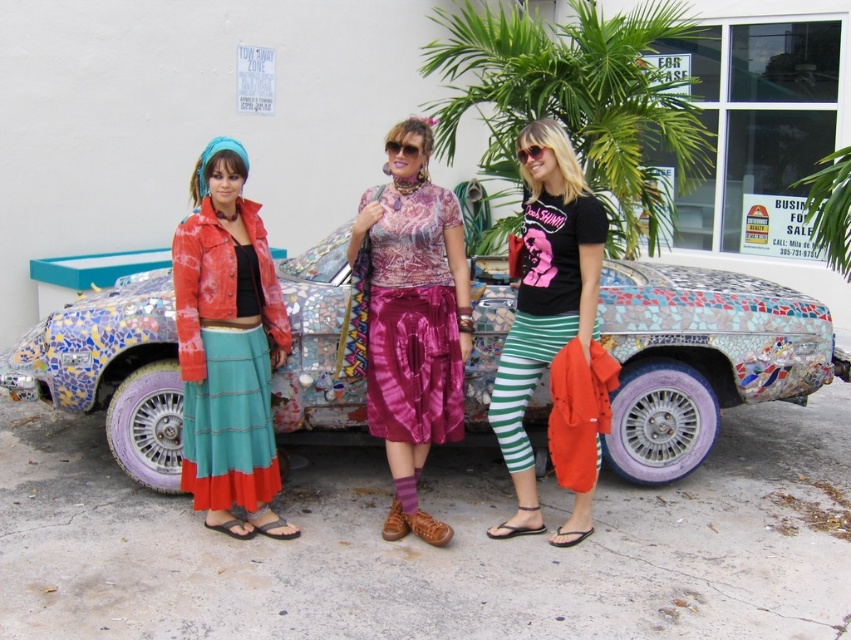
Between multicolored mosaic car at center and green striped leggings at center, which one is positioned higher?

green striped leggings at center is above.

Who is lower down, multicolored mosaic car at center or green striped leggings at center?

Positioned lower is multicolored mosaic car at center.

Is point (681, 344) farther from camera compared to point (530, 230)?

Yes, point (681, 344) is behind point (530, 230).

Find the location of a particular element. multicolored mosaic car at center is located at coordinates (701, 356).

Can you confirm if shiny silk blouse at center is positioned above green striped leggings at center?

Yes, shiny silk blouse at center is above green striped leggings at center.

Which is behind, point (421, 234) or point (597, 262)?

Positioned behind is point (421, 234).

The image size is (851, 640). Find the location of `shiny silk blouse at center`. shiny silk blouse at center is located at coordinates (413, 321).

Find the location of a particular element. This screenshot has width=851, height=640. shiny silk blouse at center is located at coordinates (413, 321).

Is matte red jacket at center to the right of green striped leggings at center from the viewer's perspective?

No, matte red jacket at center is not to the right of green striped leggings at center.

Who is more forward, (210,224) or (598,243)?

Point (598,243)

You are a GUI agent. You are given a task and a screenshot of the screen. Output one action in this format:
    pyautogui.click(x=<x>, y=<y>)
    Task: Click on the matte red jacket at center
    This screenshot has height=640, width=851.
    Given the screenshot: What is the action you would take?
    pyautogui.click(x=227, y=349)